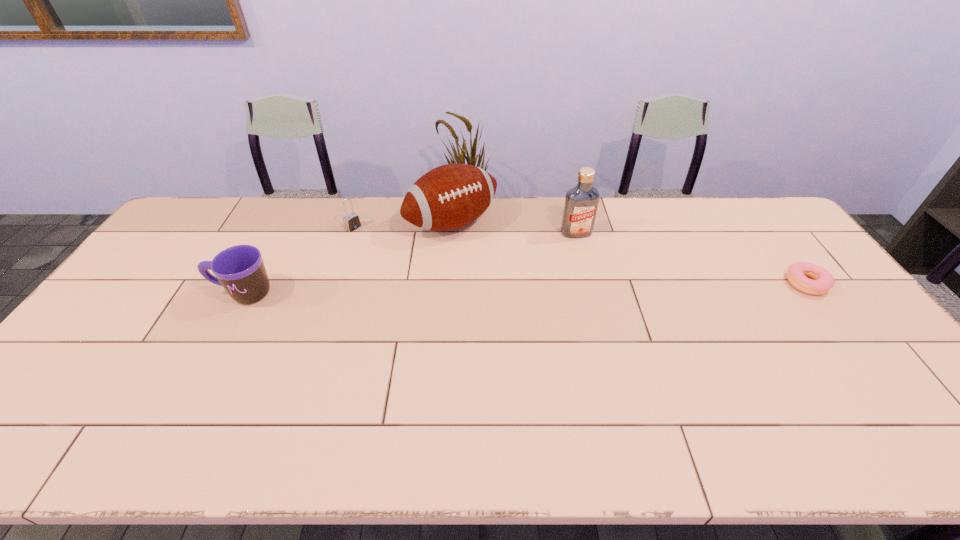
I want to click on object that is the third closest one to the padlock, so click(x=581, y=203).

Find the location of a particular element. blank space that satisfies the following two spatial constraints: 1. on the front side of the padlock; 2. on the left side of the shortest object is located at coordinates (334, 284).